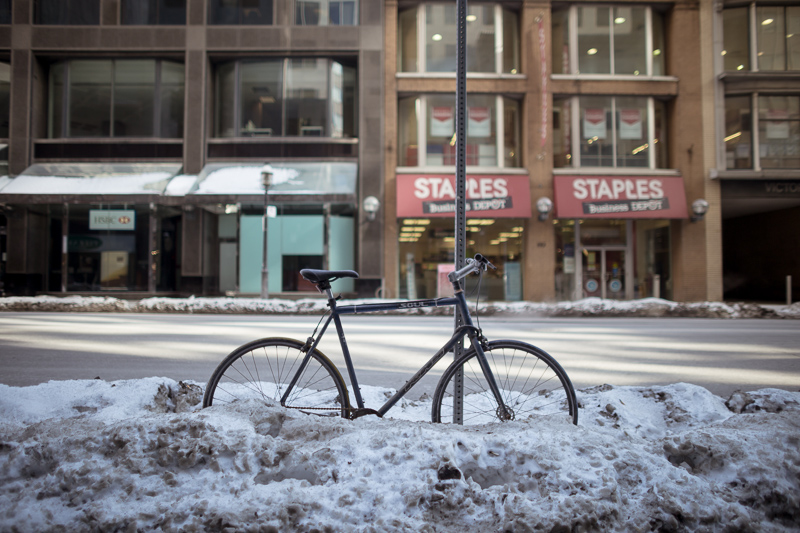
Where is `window`? window is located at coordinates [289, 95].